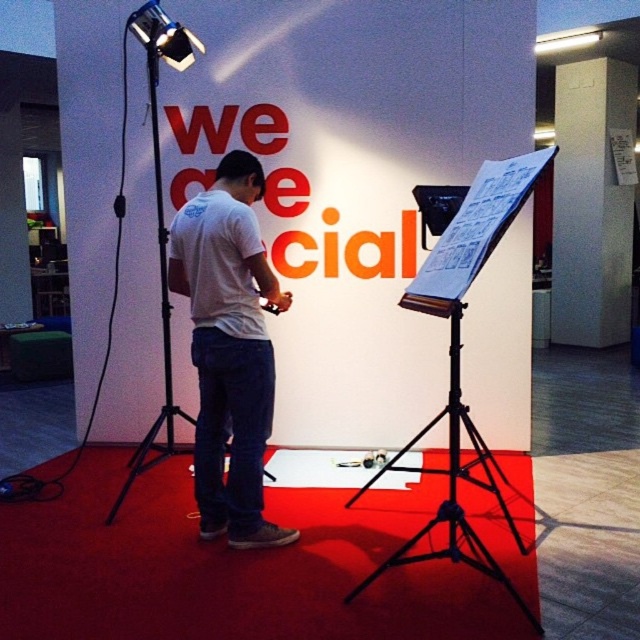
Does white matte t-shirt at center have a larger size compared to black metal tripod at left?

Incorrect, white matte t-shirt at center is not larger than black metal tripod at left.

Image resolution: width=640 pixels, height=640 pixels. I want to click on white matte t-shirt at center, so click(228, 348).

Image resolution: width=640 pixels, height=640 pixels. Find the location of `white matte t-shirt at center`. white matte t-shirt at center is located at coordinates (228, 348).

Does white smooth pillar at upper right have a lesser height compared to black metal tripod at left?

No.

Is point (593, 266) closer to viewer compared to point (156, 136)?

No, (593, 266) is behind (156, 136).

Locate an element on the screen. The image size is (640, 640). white smooth pillar at upper right is located at coordinates (593, 202).

Is black metal tripod at center positioned in front of metallic projector at upper left?

Yes, it is.

Can you confirm if black metal tripod at center is positioned above metallic projector at upper left?

Incorrect, black metal tripod at center is not positioned above metallic projector at upper left.

Where is `black metal tripod at center`? black metal tripod at center is located at coordinates (451, 476).